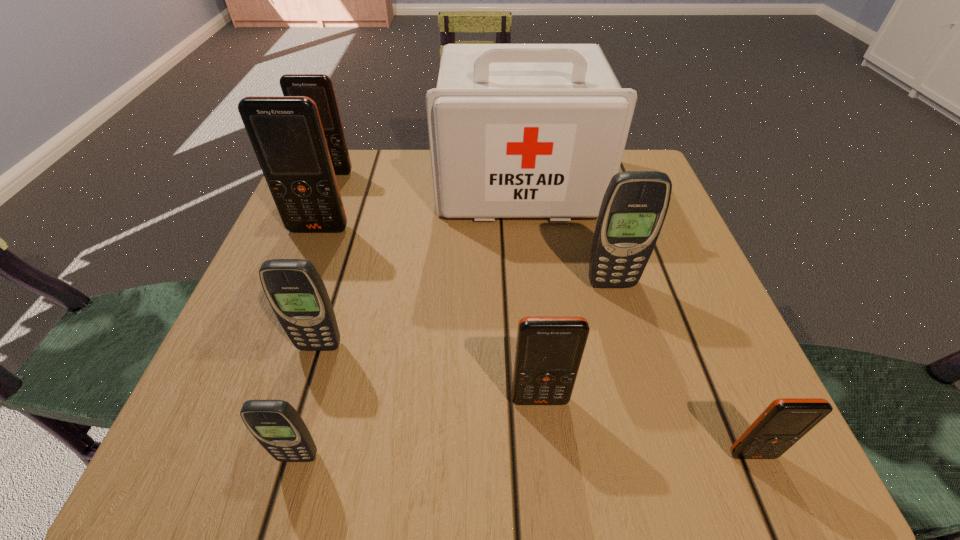
Find the location of a particular element. This screenshot has height=540, width=960. the second orange cellular telephone from right to left is located at coordinates (549, 349).

The image size is (960, 540). What are the coordinates of `the rightmost cellular telephone` in the screenshot? It's located at (785, 421).

Where is `the nearest orange cellular telephone`? the nearest orange cellular telephone is located at coordinates (785, 421).

Locate an element on the screen. The image size is (960, 540). the nearest gray cellular telephone is located at coordinates (277, 426).

Where is `free spot located on the front-facing side of the first-aid kit`? free spot located on the front-facing side of the first-aid kit is located at coordinates (538, 370).

This screenshot has width=960, height=540. In order to click on vacant region located on the screen of the seventh shortest object in this screenshot , I will do `click(287, 309)`.

The image size is (960, 540). What are the coordinates of `free region located on the screen of the third smallest orange cellular telephone` in the screenshot? It's located at (318, 205).

Where is `free location located 0.050m on the screen of the fifth nearest object`? free location located 0.050m on the screen of the fifth nearest object is located at coordinates (618, 311).

The height and width of the screenshot is (540, 960). Identify the location of blank area located on the screen of the second smallest gray cellular telephone. (286, 455).

Where is `the first-aid kit located at the far edge`? The image size is (960, 540). the first-aid kit located at the far edge is located at coordinates (515, 130).